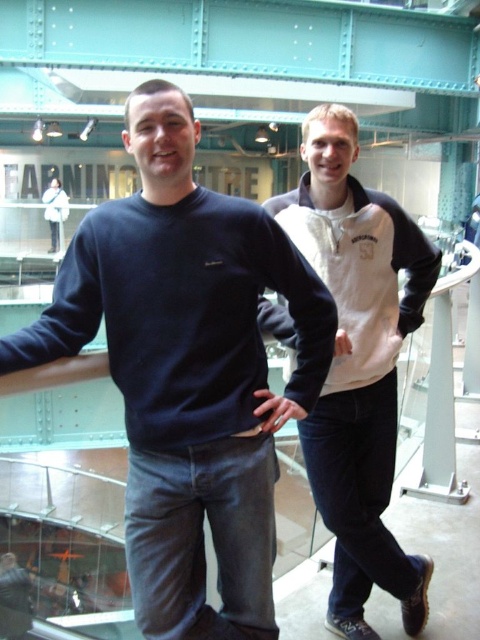
Is dark blue cotton sweatshirt at center thinner than white fleece sweatshirt at right?

No.

Between dark blue cotton sweatshirt at center and white fleece sweatshirt at right, which one appears on the left side from the viewer's perspective?

Positioned to the left is dark blue cotton sweatshirt at center.

The width and height of the screenshot is (480, 640). What are the coordinates of `dark blue cotton sweatshirt at center` in the screenshot? It's located at (181, 314).

Can you confirm if dark blue sweater at center is positioned to the left of dark blue cotton sweatshirt at center?

Indeed, dark blue sweater at center is positioned on the left side of dark blue cotton sweatshirt at center.

What do you see at coordinates (188, 371) in the screenshot?
I see `dark blue sweater at center` at bounding box center [188, 371].

The width and height of the screenshot is (480, 640). In order to click on dark blue sweater at center in this screenshot , I will do 188,371.

Can you confirm if dark blue cotton sweatshirt at center is bigger than matte black sweater at center?

Actually, dark blue cotton sweatshirt at center might be smaller than matte black sweater at center.

How much distance is there between dark blue cotton sweatshirt at center and matte black sweater at center?

dark blue cotton sweatshirt at center is 52.25 feet away from matte black sweater at center.

This screenshot has height=640, width=480. I want to click on dark blue cotton sweatshirt at center, so click(x=181, y=314).